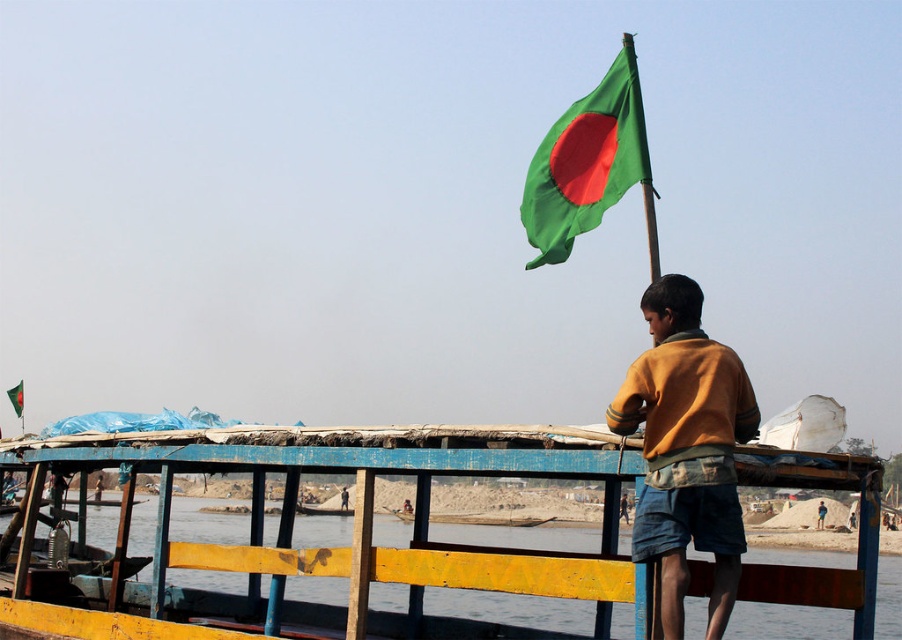
Question: Is the position of brown leather jacket at upper right more distant than that of brown wooden pole at upper center?

Choices:
 (A) no
 (B) yes

Answer: (A)

Question: Which point is farther to the camera?

Choices:
 (A) (343, 508)
 (B) (629, 152)
 (C) (20, 408)
 (D) (661, 362)

Answer: (A)

Question: Does transparent water at boat right have a smaller size compared to green fabric flag at upper center?

Choices:
 (A) no
 (B) yes

Answer: (A)

Question: Which of the following is the farthest from the observer?

Choices:
 (A) (343, 504)
 (B) (673, 396)
 (C) (578, 113)
 (D) (316, 512)

Answer: (A)

Question: In this image, where is green fabric flag at upper right located relative to brown wooden pole at upper center?

Choices:
 (A) left
 (B) right

Answer: (A)

Question: Which of the following is the closest to the observer?

Choices:
 (A) (619, 508)
 (B) (824, 509)
 (C) (575, 129)
 (D) (698, 428)

Answer: (D)